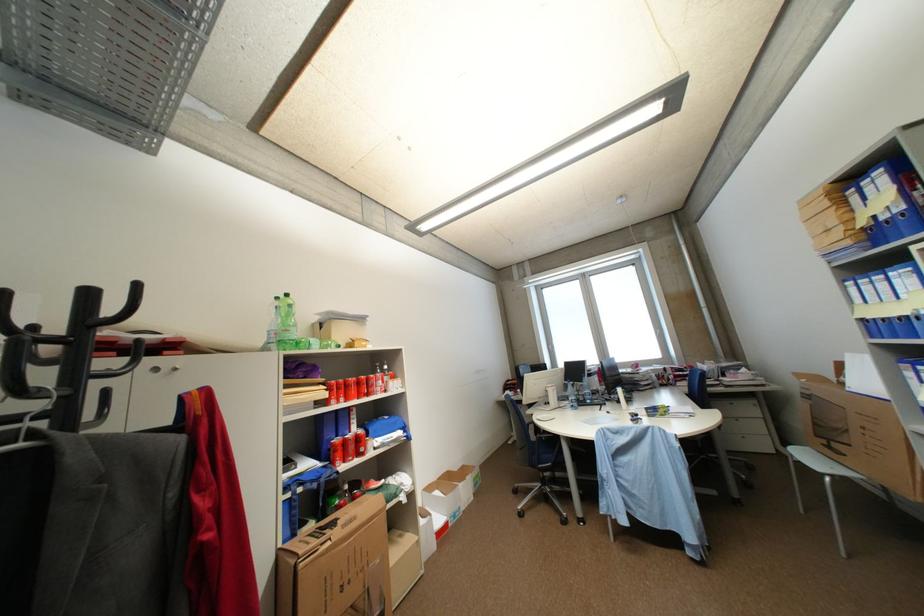
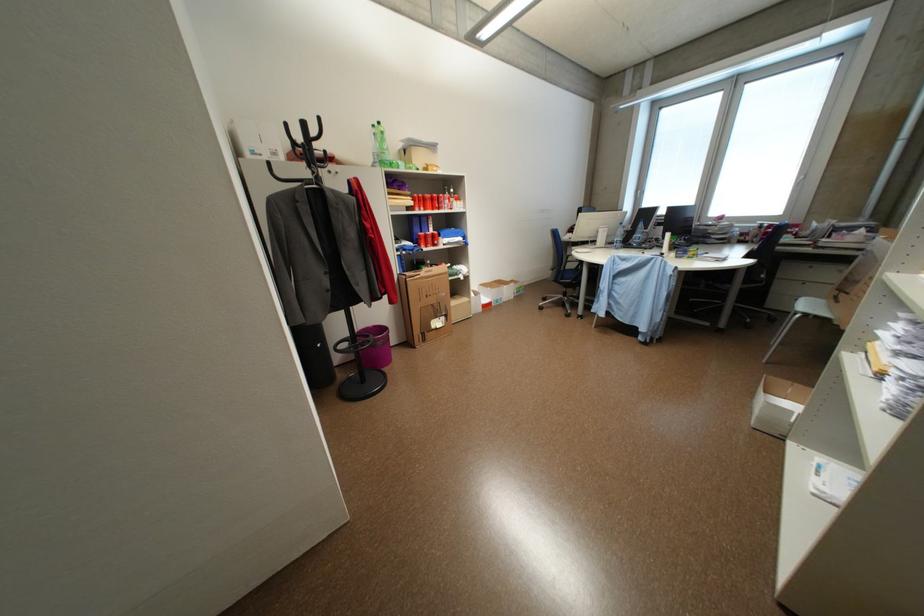
The point at (438,490) is marked in the first image. Where is the corresponding point in the second image?

(492, 286)